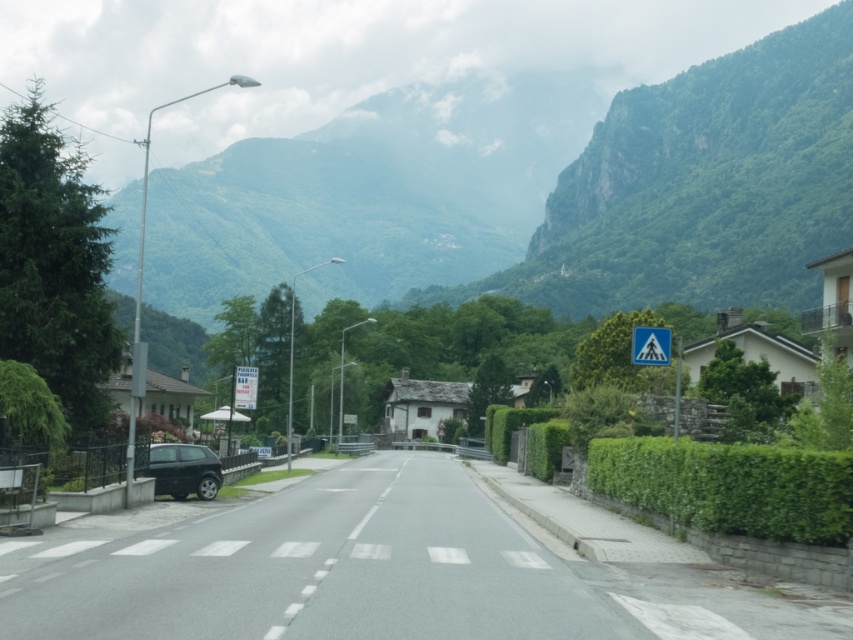
Question: Does shiny black car at lower left lie in front of white plastic pedestrian crossing sign at right?

Choices:
 (A) yes
 (B) no

Answer: (B)

Question: Among these points, which one is farthest from the camera?

Choices:
 (A) (210, 470)
 (B) (718, 205)
 (C) (648, 344)
 (D) (256, 371)

Answer: (B)

Question: Can you confirm if green rocky mountain at upper center is smaller than white plastic sign at left?

Choices:
 (A) yes
 (B) no

Answer: (B)

Question: Estimate the real-world distances between objects in this image. Which object is closer to the green rocky mountain at upper center?

Choices:
 (A) shiny black car at lower left
 (B) white plastic pedestrian crossing sign at right
 (C) white plastic sign at left

Answer: (C)

Question: In this image, where is green rocky mountain at upper center located relative to white plastic pedestrian crossing sign at right?

Choices:
 (A) right
 (B) left

Answer: (A)

Question: Which of the following is the closest to the observer?

Choices:
 (A) (599, 280)
 (B) (148, 474)
 (C) (653, 337)
 (D) (242, 396)

Answer: (C)